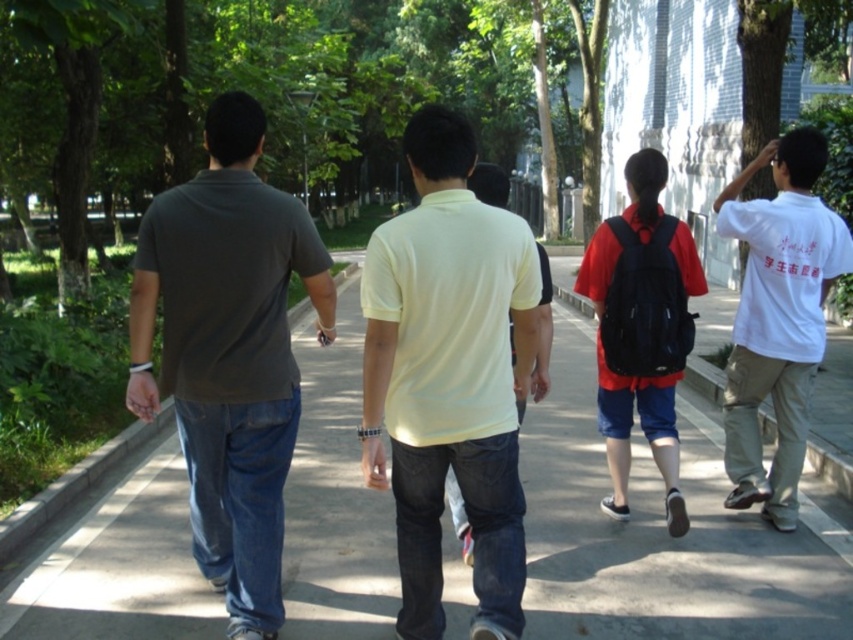
Can you confirm if white cotton shirt at right is wider than matte black backpack at center?

Yes.

Is white cotton shirt at right bigger than matte black backpack at center?

Indeed, white cotton shirt at right has a larger size compared to matte black backpack at center.

Who is more forward, (791, 440) or (590, 257)?

Point (590, 257) is more forward.

The height and width of the screenshot is (640, 853). Identify the location of white cotton shirt at right. (776, 316).

Is point (389, 516) farther from viewer compared to point (751, 374)?

Yes, point (389, 516) is farther from viewer.

Can you confirm if gray concrete pavement at center is taller than white cotton shirt at right?

In fact, gray concrete pavement at center may be shorter than white cotton shirt at right.

Between point (583, 369) and point (819, 163), which one is positioned in front?

Point (819, 163) is in front.

Find the location of `gray concrete pavement at center`. gray concrete pavement at center is located at coordinates (660, 536).

Can you confirm if yellow cotton shirt at center is shorter than white cotton shirt at right?

Yes.

Is yellow cotton shirt at center wider than white cotton shirt at right?

Yes, yellow cotton shirt at center is wider than white cotton shirt at right.

At what (x,y) coordinates should I click in order to perform the action: click on yellow cotton shirt at center. Please return your answer as a coordinate pair (x, y). This screenshot has height=640, width=853. Looking at the image, I should click on point(450,376).